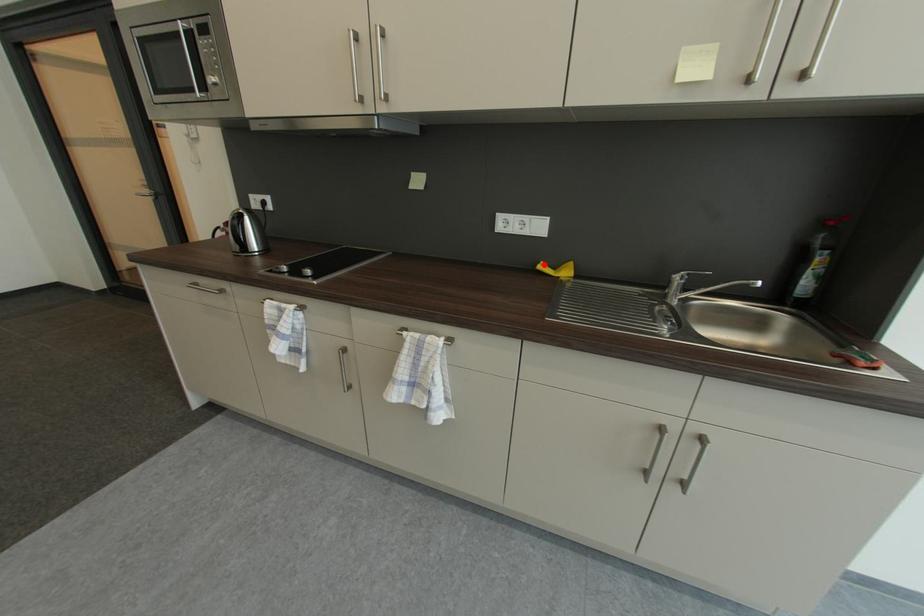
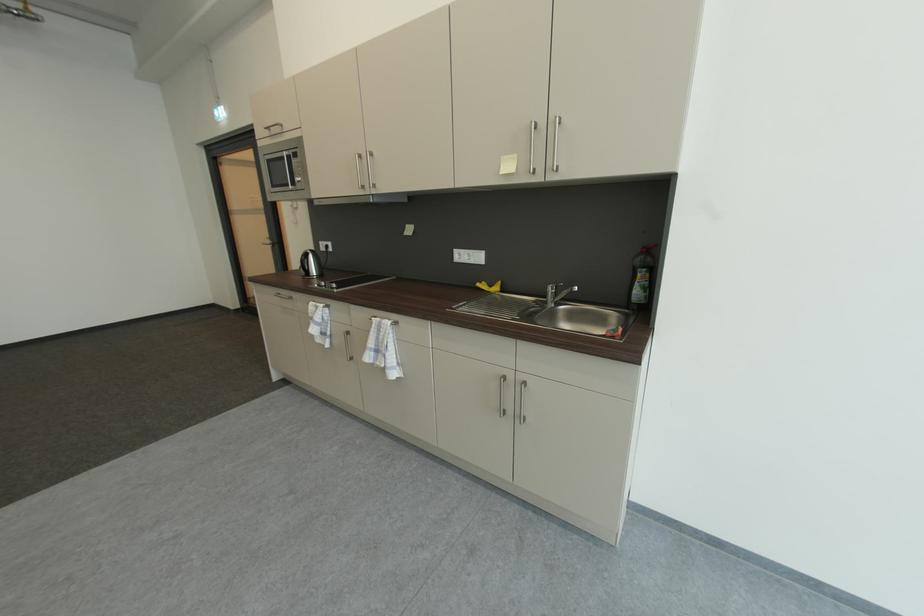
Where in the second image is the point corresponding to the highlighted location from the first image?

(487, 284)